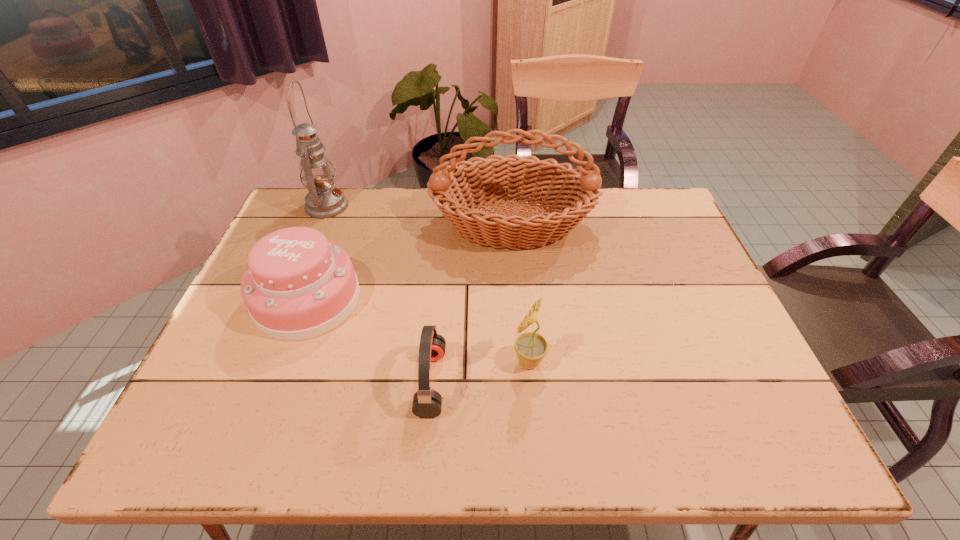
Find the location of a particular element. the tallest object is located at coordinates (324, 200).

This screenshot has width=960, height=540. I want to click on the second tallest object, so click(571, 194).

Find the location of `sunflower`. sunflower is located at coordinates (531, 347).

The image size is (960, 540). What are the coordinates of `birthday cake` in the screenshot? It's located at (298, 285).

Where is `the shortest object`? The width and height of the screenshot is (960, 540). the shortest object is located at coordinates (427, 402).

This screenshot has width=960, height=540. Identify the location of free location located on the front of the oil lamp. (308, 251).

The height and width of the screenshot is (540, 960). What are the coordinates of `free point located on the right of the basket` in the screenshot? It's located at (678, 224).

Find the location of `vacant region located on the face of the sunflower`. vacant region located on the face of the sunflower is located at coordinates (363, 362).

The height and width of the screenshot is (540, 960). Identify the location of free location located on the face of the sunflower. (345, 362).

Locate an element on the screen. This screenshot has width=960, height=540. free point located on the face of the sunflower is located at coordinates (486, 362).